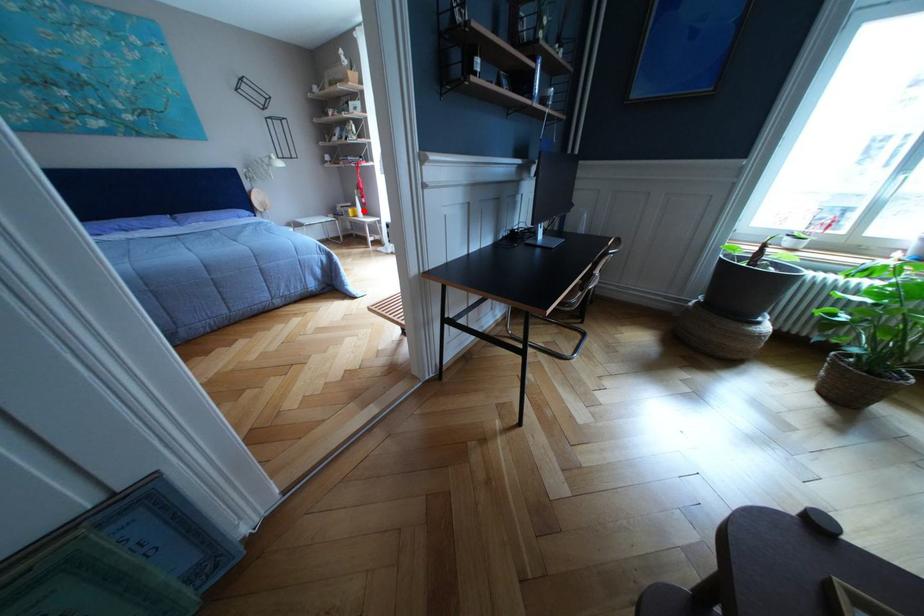
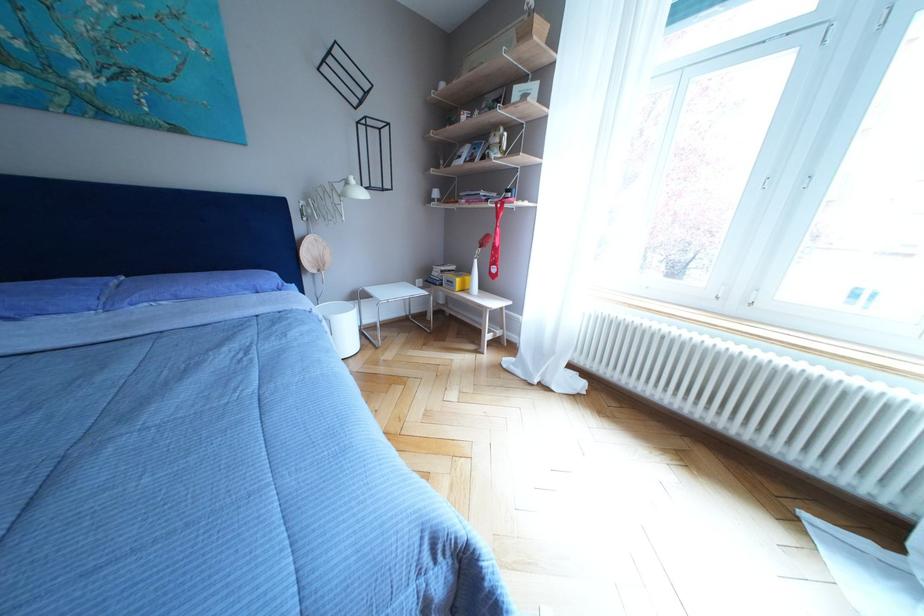
Question: A red point is marked in image1. In image2, is the corresponding 3D point closer to the camera or farther? Reply with the corresponding letter.

Choices:
 (A) The corresponding 3D point is closer.
 (B) The corresponding 3D point is farther.

Answer: (B)